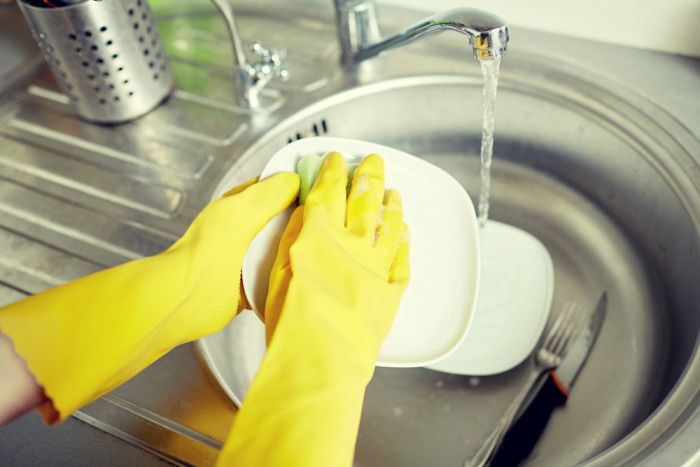
Locate an element on the screen. plate is located at coordinates (497, 310), (449, 306).